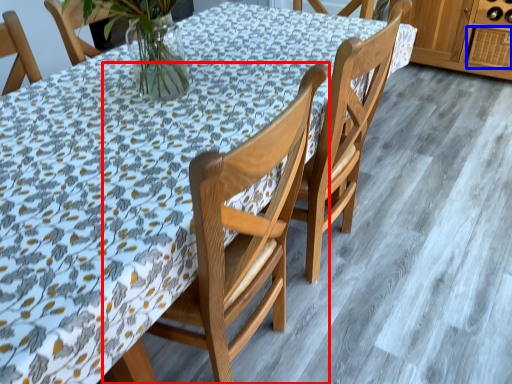
Question: Which object is further to the camera taking this photo, chair (highlighted by a red box) or drawer (highlighted by a blue box)?

Choices:
 (A) chair
 (B) drawer

Answer: (B)